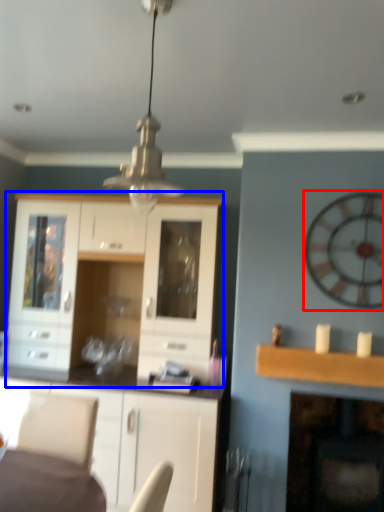
Question: Which of the following is the farthest to the observer, clock (highlighted by a red box) or cabinetry (highlighted by a blue box)?

Choices:
 (A) clock
 (B) cabinetry

Answer: (B)